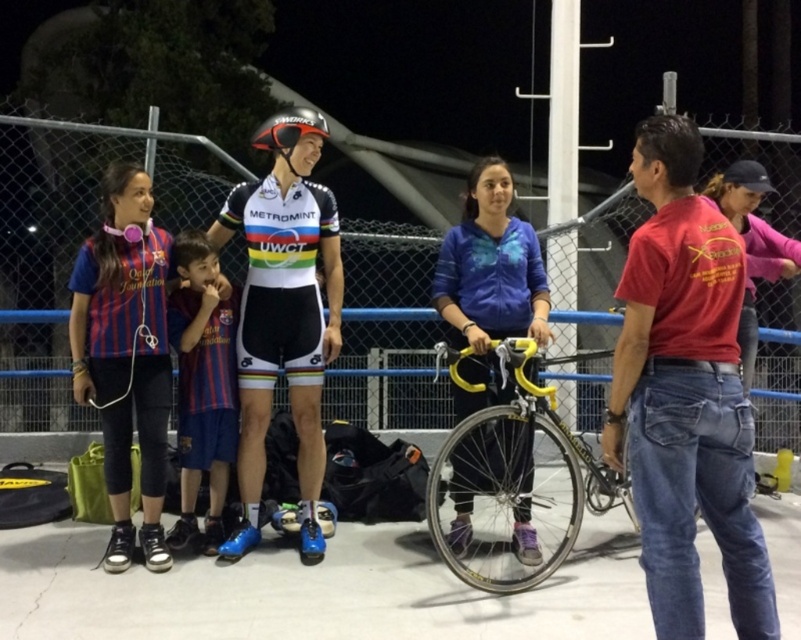
You are a photographer trying to capture both the striped jersey at left and the pink cotton shirt at right in a single frame. Based on their positions, which one should you focus on first to ensure both are in the frame?

The striped jersey at left is located below the pink cotton shirt at right, so you should focus on the pink cotton shirt at right first to ensure both are in the frame.

You are organizing a cycling event and need to ensure that all participants have jerseys of the correct size. You notice two jerseys in the image, the striped jersey at left and the matte jersey at center. Which jersey should you choose for a participant who needs a larger size?

The striped jersey at left is bigger than the matte jersey at center, so you should choose the striped jersey at left for the participant who needs a larger size.

You are standing at the point with coordinates point [769,186] and want to walk towards point [163,257]. Is the point you want to reach in front of or behind you?

Point [163,257] is in front of point [769,186], so the point you want to reach is in front of you.